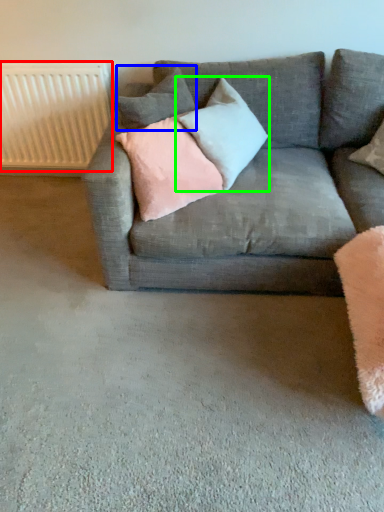
Question: Which object is positioned closest to radiator (highlighted by a red box)? Select from pillow (highlighted by a blue box) and pillow (highlighted by a green box).

Choices:
 (A) pillow
 (B) pillow

Answer: (A)